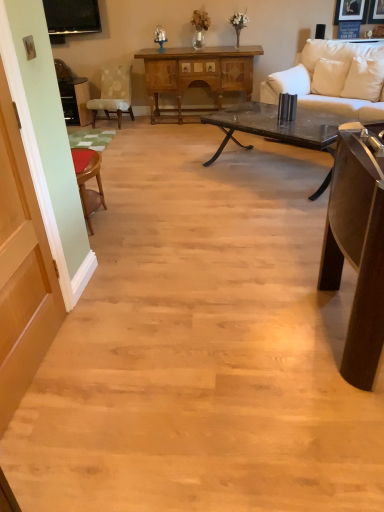
Find the location of `vacant space in front of black glass coffee table at center`. vacant space in front of black glass coffee table at center is located at coordinates (256, 216).